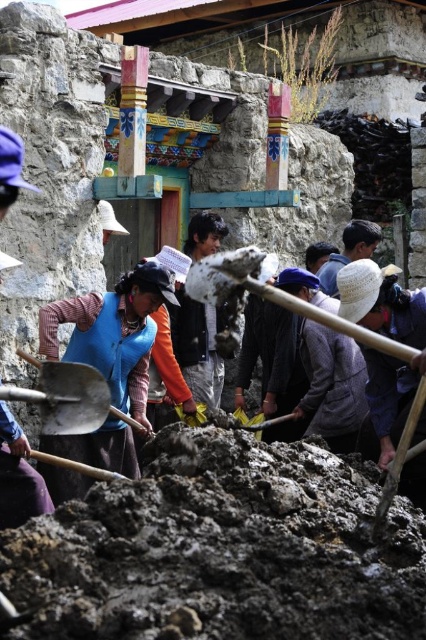
Question: Does dark brown clay at center come behind smooth wooden shovel at center?

Choices:
 (A) yes
 (B) no

Answer: (B)

Question: Which is farther from the blue fabric vest at center?

Choices:
 (A) matte metal shovel at lower center
 (B) dark brown clay at center
 (C) metallic silver shovel at center

Answer: (A)

Question: Based on their relative distances, which object is nearer to the blue fabric vest at center?

Choices:
 (A) matte metal shovel at lower center
 (B) dark brown clay at center
 (C) smooth wooden shovel at center
 (D) metallic silver shovel at center

Answer: (D)

Question: Is the position of dark brown clay at center less distant than that of matte metal shovel at lower center?

Choices:
 (A) yes
 (B) no

Answer: (A)

Question: Does blue fabric vest at center appear on the right side of matte metal shovel at lower center?

Choices:
 (A) no
 (B) yes

Answer: (A)

Question: Which point is farther to the camera?

Choices:
 (A) blue fabric vest at center
 (B) metallic silver shovel at center
 (C) dark brown clay at center
 (D) smooth wooden shovel at center

Answer: (A)